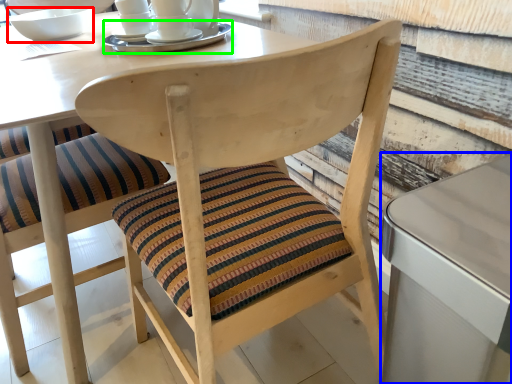
Question: Which object is positioned closest to bowl (highlighted by a red box)? Select from table (highlighted by a blue box) and tableware (highlighted by a green box).

Choices:
 (A) table
 (B) tableware

Answer: (B)